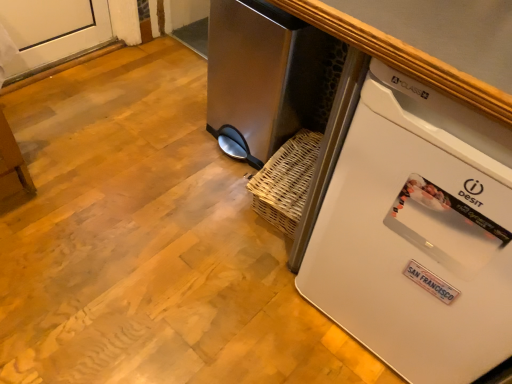
This screenshot has width=512, height=384. Find the location of `free location to the left of stainless steel trash can at center`. free location to the left of stainless steel trash can at center is located at coordinates (172, 126).